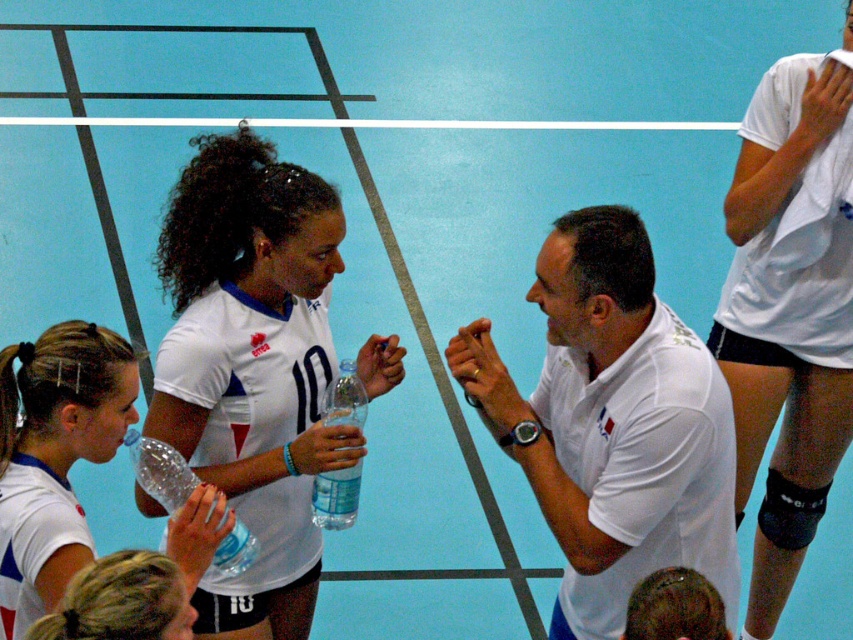
What object is located at the coordinates point (788, 312)?

The point (788, 312) indicates a white matte knee pad at upper right.

You are a volleyball player preparing for a match and need to place your equipment on the court. If you have both the white matte knee pad at upper right and the transparent plastic bottle at center, which item can you place closer to the boundary line without exceeding the court limits?

The transparent plastic bottle at center can be placed closer to the boundary line because the white matte knee pad at upper right is larger in size and might require more space to stay within the court limits.

You are a volleyball player preparing to join the game. You see the white matte knee pad at upper right and the clear plastic bottle at center. Which item is larger in size?

The white matte knee pad at upper right is bigger than the clear plastic bottle at center.